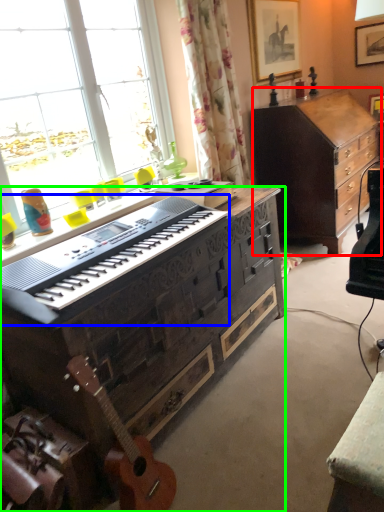
Question: Which is nearer to the cabinetry (highlighted by a red box)? piano (highlighted by a blue box) or desk (highlighted by a green box).

Choices:
 (A) piano
 (B) desk

Answer: (B)